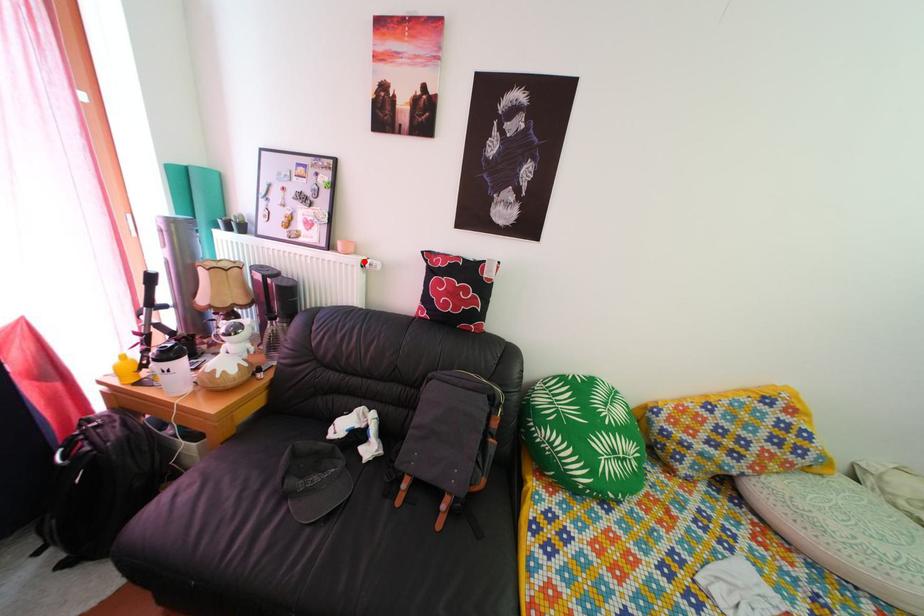
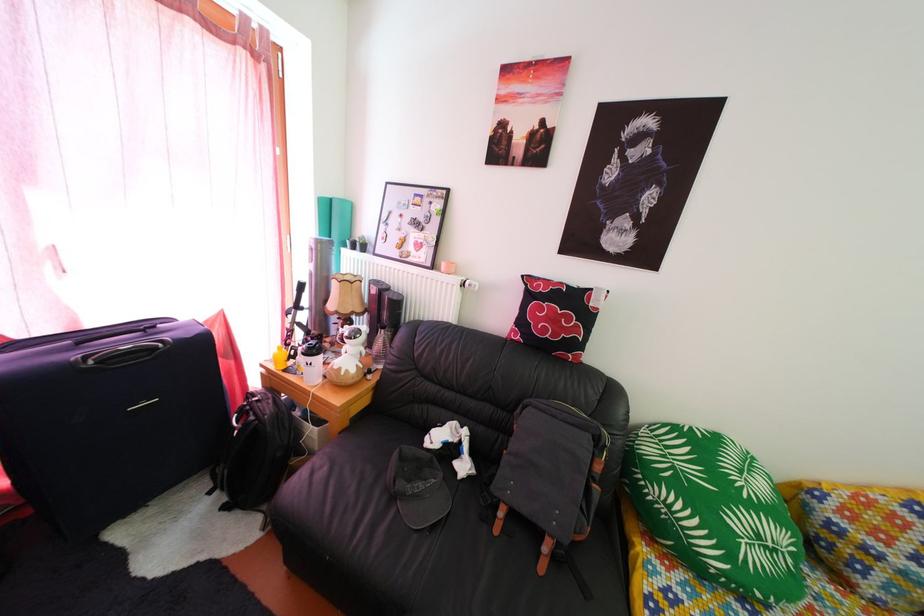
Locate, in the second image, the point that corresponds to the highlighted location in the first image.

(464, 282)